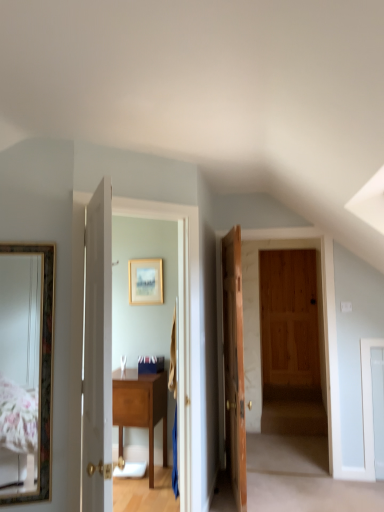
Question: From the image's perspective, would you say white wooden door at center, which is the second door from back to front, is positioned over gold-framed picture at center?

Choices:
 (A) yes
 (B) no

Answer: (B)

Question: Could gold-framed picture at center be considered to be inside white wooden door at center, which is counted as the 1th door, starting from the front?

Choices:
 (A) no
 (B) yes

Answer: (A)

Question: Does white wooden door at center, which is the second door from back to front, appear on the left side of gold-framed picture at center?

Choices:
 (A) yes
 (B) no

Answer: (A)

Question: Is white wooden door at center, which is the second door from back to front, far away from gold-framed picture at center?

Choices:
 (A) no
 (B) yes

Answer: (B)

Question: Can you confirm if white wooden door at center, positioned as the 2th door in right-to-left order, is smaller than gold-framed picture at center?

Choices:
 (A) yes
 (B) no

Answer: (B)

Question: From the image's perspective, is gold-framed picture at center positioned above or below white wooden door at center, which ranks as the first door in left-to-right order?

Choices:
 (A) below
 (B) above

Answer: (B)

Question: Considering the positions of gold-framed picture at center and white wooden door at center, which ranks as the first door in left-to-right order, in the image, is gold-framed picture at center taller or shorter than white wooden door at center, which ranks as the first door in left-to-right order,?

Choices:
 (A) tall
 (B) short

Answer: (B)

Question: From a real-world perspective, is gold-framed picture at center physically located above or below white wooden door at center, positioned as the 2th door in right-to-left order?

Choices:
 (A) above
 (B) below

Answer: (A)

Question: In the image, is gold-framed picture at center positioned in front of or behind white wooden door at center, which is the second door from back to front?

Choices:
 (A) behind
 (B) front

Answer: (A)

Question: In the image, is wooden table at center on the left side or the right side of white wooden door at center, which is the second door from back to front?

Choices:
 (A) left
 (B) right

Answer: (A)

Question: Based on their sizes in the image, would you say wooden table at center is bigger or smaller than white wooden door at center, which ranks as the first door in left-to-right order?

Choices:
 (A) small
 (B) big

Answer: (A)

Question: From the image's perspective, is wooden table at center positioned above or below white wooden door at center, which is the second door from back to front?

Choices:
 (A) above
 (B) below

Answer: (B)

Question: Considering the positions of point (137, 407) and point (102, 408), is point (137, 407) closer or farther from the camera than point (102, 408)?

Choices:
 (A) closer
 (B) farther

Answer: (B)

Question: Is wooden door at center, which appears as the second door when viewed from the front, situated inside gold-framed picture at center or outside?

Choices:
 (A) inside
 (B) outside

Answer: (B)

Question: Looking at their shapes, would you say wooden door at center, arranged as the first door when viewed from the right, is wider or thinner than gold-framed picture at center?

Choices:
 (A) wide
 (B) thin

Answer: (A)